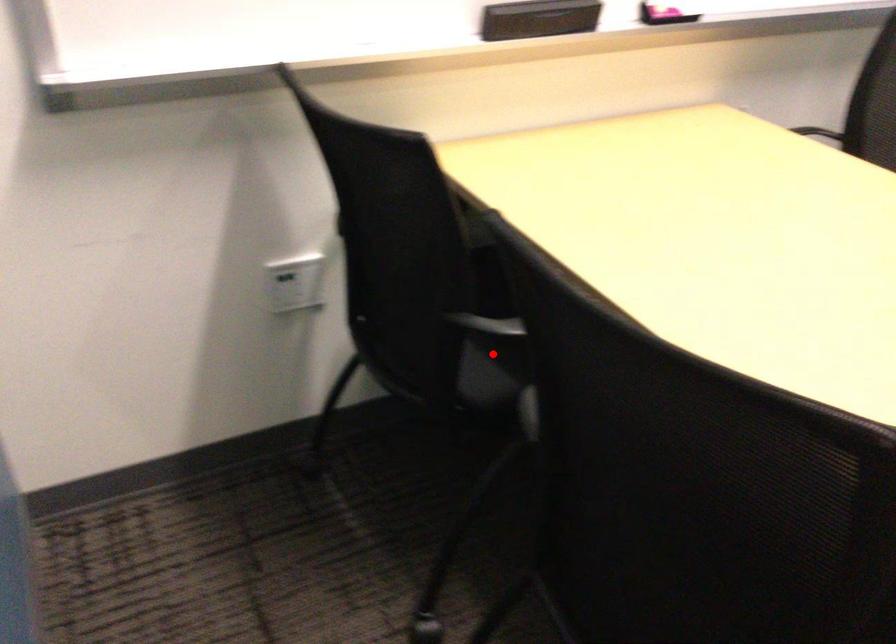
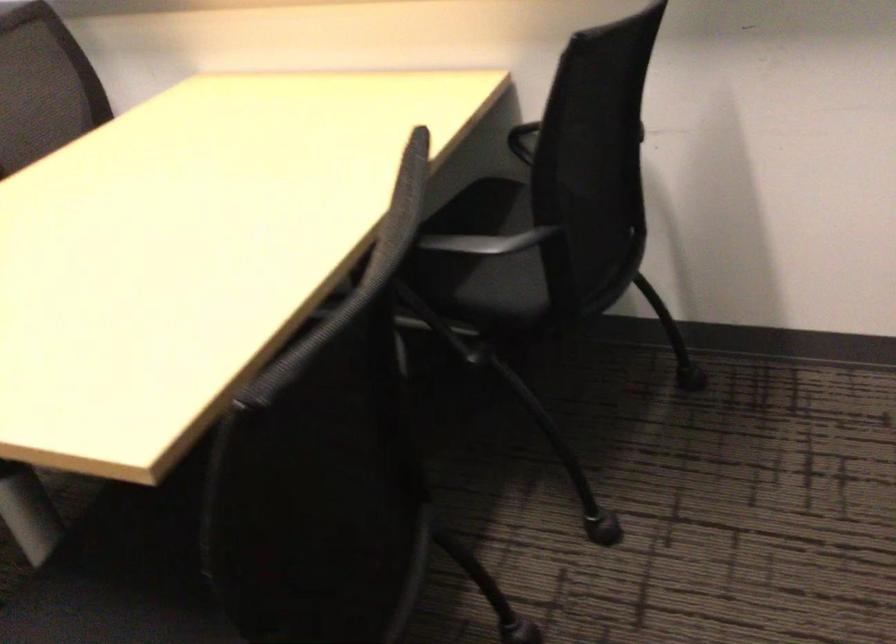
Question: I am providing you with two images of the same scene from different viewpoints. A red point is marked on the first image. At the location where the point appears in image 1, is it still visible in image 2?

Choices:
 (A) Yes
 (B) No

Answer: (B)